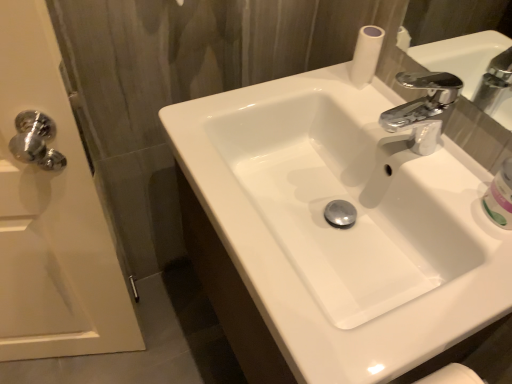
Question: Does white glossy mouthwash at right have a lesser width compared to white glossy door handle at left?

Choices:
 (A) no
 (B) yes

Answer: (B)

Question: From the image's perspective, is white glossy mouthwash at right above white glossy door handle at left?

Choices:
 (A) yes
 (B) no

Answer: (A)

Question: Could you tell me if white glossy mouthwash at right is facing white glossy door handle at left?

Choices:
 (A) no
 (B) yes

Answer: (A)

Question: Is white glossy mouthwash at right turned away from white glossy door handle at left?

Choices:
 (A) yes
 (B) no

Answer: (B)

Question: Is the position of white glossy mouthwash at right more distant than that of white glossy door handle at left?

Choices:
 (A) yes
 (B) no

Answer: (A)

Question: In the image, is white glossy sink at center positioned in front of or behind white glossy door handle at left?

Choices:
 (A) front
 (B) behind

Answer: (A)

Question: Considering the relative positions of white glossy sink at center and white glossy door handle at left in the image provided, is white glossy sink at center to the left or to the right of white glossy door handle at left?

Choices:
 (A) right
 (B) left

Answer: (A)

Question: Is white glossy sink at center spatially inside white glossy door handle at left, or outside of it?

Choices:
 (A) inside
 (B) outside

Answer: (B)

Question: From the image's perspective, is white glossy sink at center above or below white glossy door handle at left?

Choices:
 (A) above
 (B) below

Answer: (A)

Question: Choose the correct answer: Is white glossy mouthwash at right inside white glossy door handle at left or outside it?

Choices:
 (A) outside
 (B) inside

Answer: (A)

Question: In the image, is white glossy mouthwash at right positioned in front of or behind white glossy door handle at left?

Choices:
 (A) behind
 (B) front

Answer: (A)

Question: From a real-world perspective, is white glossy mouthwash at right physically located above or below white glossy door handle at left?

Choices:
 (A) below
 (B) above

Answer: (B)

Question: Considering the positions of point (495, 188) and point (28, 34), is point (495, 188) closer or farther from the camera than point (28, 34)?

Choices:
 (A) closer
 (B) farther

Answer: (B)

Question: Considering the positions of point (452, 261) and point (488, 185), is point (452, 261) closer or farther from the camera than point (488, 185)?

Choices:
 (A) closer
 (B) farther

Answer: (A)

Question: In terms of width, does white glossy sink at center look wider or thinner when compared to white glossy mouthwash at right?

Choices:
 (A) thin
 (B) wide

Answer: (B)